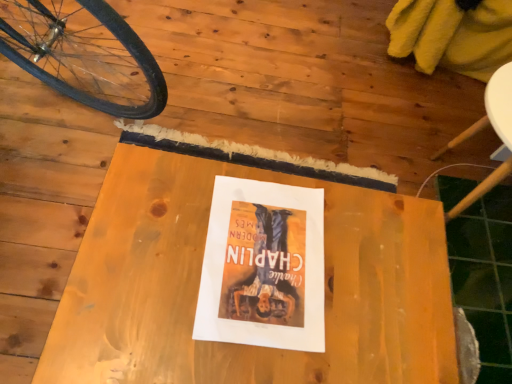
The image size is (512, 384). Identify the location of white paper at center. (263, 267).

Measure the distance between point (218, 258) and camera.

The depth of point (218, 258) is 72.20 centimeters.

What do you see at coordinates (263, 267) in the screenshot? The image size is (512, 384). I see `white paper at center` at bounding box center [263, 267].

What do you see at coordinates (200, 275) in the screenshot? I see `wooden table at center` at bounding box center [200, 275].

Locate an element on the screen. wooden table at center is located at coordinates (200, 275).

At what (x,y) coordinates should I click in order to perform the action: click on white paper at center. Please return your answer as a coordinate pair (x, y). Image resolution: width=512 pixels, height=384 pixels. Looking at the image, I should click on (263, 267).

Looking at this image, which is more to the right, wooden table at center or white paper at center?

Positioned to the right is white paper at center.

Is wooden table at center behind white paper at center?

No, it is not.

Does point (401, 208) come farther from viewer compared to point (293, 187)?

Yes, it is behind point (293, 187).

From the image's perspective, which one is positioned higher, wooden table at center or white paper at center?

white paper at center appears higher in the image.

From a real-world perspective, does wooden table at center sit lower than white paper at center?

Correct, in the physical world, wooden table at center is lower than white paper at center.

In the scene shown: Which of these two, wooden table at center or white paper at center, is thinner?

With smaller width is white paper at center.

Is wooden table at center taller than white paper at center?

Indeed, wooden table at center has a greater height compared to white paper at center.

Who is bigger, wooden table at center or white paper at center?

With larger size is wooden table at center.

In the scene shown: Would you say white paper at center is part of wooden table at center's contents?

Yes, white paper at center is surrounded by wooden table at center.

In the scene shown: Are wooden table at center and white paper at center far apart?

That's not correct — wooden table at center is a little close to white paper at center.

Is wooden table at center oriented towards white paper at center?

No, wooden table at center is not oriented towards white paper at center.

How far apart are wooden table at center and white paper at center?

They are 3.31 inches apart.

Identify the location of table below the white paper at center (from a real-world perspective). The image size is (512, 384). (200, 275).

Is white paper at center at the right side of wooden table at center?

Yes.

Considering the positions of objects white paper at center and wooden table at center in the image provided, who is behind, white paper at center or wooden table at center?

Positioned behind is white paper at center.

Which is in front, point (274, 268) or point (397, 323)?

The point (397, 323) is closer.

From the image's perspective, is white paper at center positioned above or below wooden table at center?

white paper at center is situated higher than wooden table at center in the image.

From a real-world perspective, which is physically above, white paper at center or wooden table at center?

white paper at center is physically above.

In terms of width, does white paper at center look wider or thinner when compared to wooden table at center?

Clearly, white paper at center has less width compared to wooden table at center.

Between white paper at center and wooden table at center, which one has less height?

Standing shorter between the two is white paper at center.

Which of these two, white paper at center or wooden table at center, is smaller?

white paper at center is smaller.

Is wooden table at center surrounded by white paper at center?

That's incorrect, wooden table at center is not inside white paper at center.

Are white paper at center and wooden table at center far apart?

No.

Could you tell me if white paper at center is turned towards wooden table at center?

Yes.

Identify the location of paperback book that appears on the right of wooden table at center. point(263,267).

Identify the location of paperback book that appears behind the wooden table at center. (263, 267).

Locate an element on the screen. This screenshot has height=384, width=512. paperback book lying above the wooden table at center (from the image's perspective) is located at coordinates (263, 267).